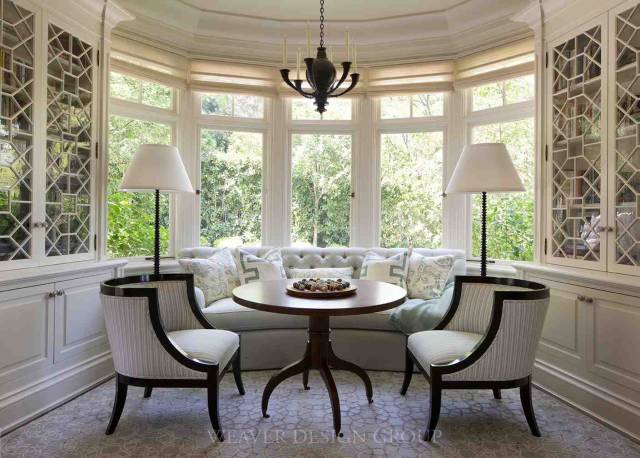
The height and width of the screenshot is (458, 640). Identify the location of floor. (276, 422).